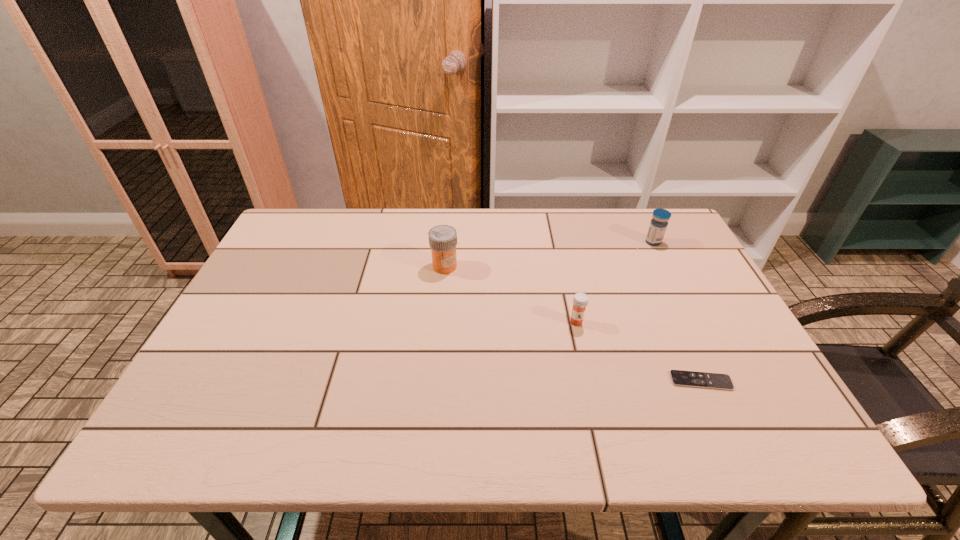
I want to click on the third nearest object, so click(x=442, y=239).

Identify the location of the second nearest medicine. The width and height of the screenshot is (960, 540). (442, 239).

Find the location of a particular element. Image resolution: width=960 pixels, height=540 pixels. the farthest medicine is located at coordinates (658, 225).

The height and width of the screenshot is (540, 960). Identify the location of the rightmost medicine. (658, 225).

Where is `the nearest medicine`? This screenshot has width=960, height=540. the nearest medicine is located at coordinates (580, 300).

Find the location of a particular element. the second medicine from left to right is located at coordinates (580, 300).

You are a GUI agent. You are given a task and a screenshot of the screen. Output one action in this format:
    pyautogui.click(x=<x>, y=<y>)
    Task: Click on the remote control
    
    Given the screenshot: What is the action you would take?
    pyautogui.click(x=679, y=378)

The height and width of the screenshot is (540, 960). Find the location of `the shortest object`. the shortest object is located at coordinates (679, 378).

Locate an element on the screen. This screenshot has height=540, width=960. vacant space located 0.050m on the label side of the second nearest medicine is located at coordinates (443, 287).

Where is `free point located on the left of the farthest medicine`? The width and height of the screenshot is (960, 540). free point located on the left of the farthest medicine is located at coordinates (542, 242).